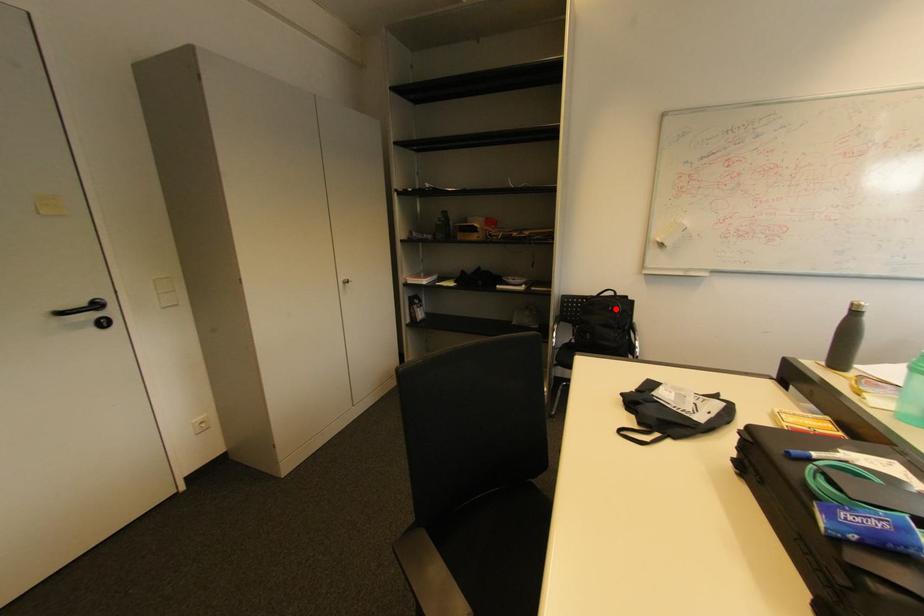
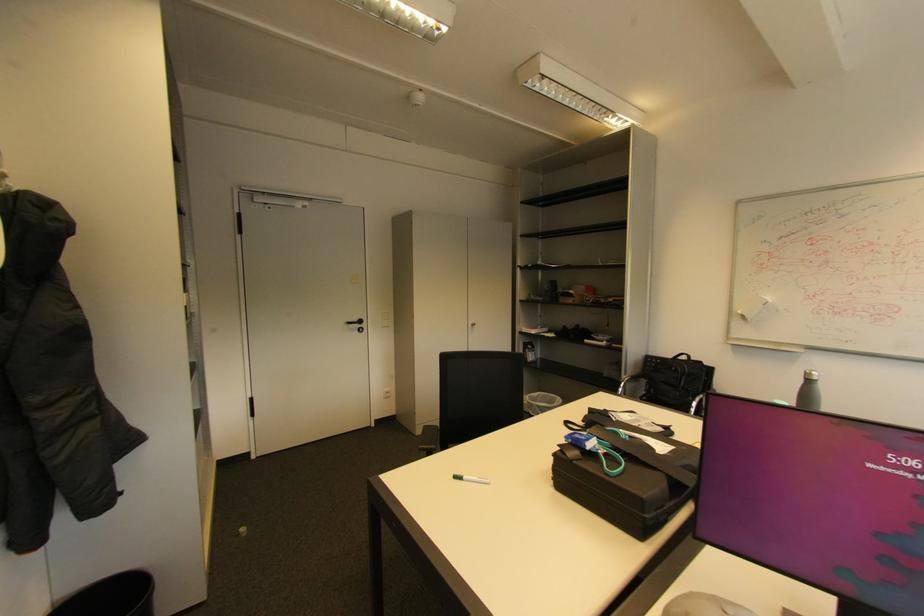
Where in the second image is the point corresponding to the highlighted location from the first image?

(678, 369)